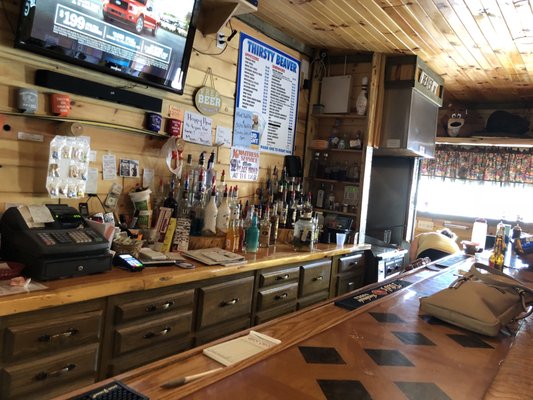
This screenshot has height=400, width=533. What are the coordinates of `curtain` in the screenshot? It's located at (478, 166).